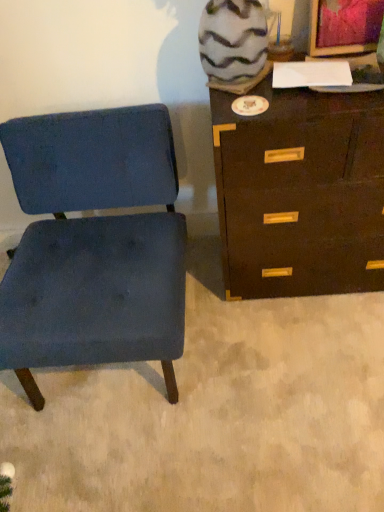
Find the location of a particular element. The width and height of the screenshot is (384, 512). blue fabric chair at left is located at coordinates (94, 244).

Describe the element at coordinates (94, 244) in the screenshot. I see `blue fabric chair at left` at that location.

The height and width of the screenshot is (512, 384). What do you see at coordinates (300, 193) in the screenshot? I see `dark brown wood chest of drawers at right` at bounding box center [300, 193].

Locate an element on the screen. This screenshot has height=512, width=384. dark brown wood chest of drawers at right is located at coordinates (300, 193).

At what (x,y) coordinates should I click in order to perform the action: click on blue fabric chair at left. Please return your answer as a coordinate pair (x, y). The width and height of the screenshot is (384, 512). Looking at the image, I should click on (94, 244).

Which is more to the right, dark brown wood chest of drawers at right or blue fabric chair at left?

Positioned to the right is dark brown wood chest of drawers at right.

Between dark brown wood chest of drawers at right and blue fabric chair at left, which one is positioned behind?

dark brown wood chest of drawers at right is further away from the camera.

Which is behind, point (373, 156) or point (55, 200)?

Positioned behind is point (55, 200).

From the image's perspective, which is above, dark brown wood chest of drawers at right or blue fabric chair at left?

dark brown wood chest of drawers at right is shown above in the image.

From a real-world perspective, is dark brown wood chest of drawers at right above or below blue fabric chair at left?

Clearly, from a real-world perspective, dark brown wood chest of drawers at right is above blue fabric chair at left.

Which object is wider, dark brown wood chest of drawers at right or blue fabric chair at left?

blue fabric chair at left.

Does dark brown wood chest of drawers at right have a lesser height compared to blue fabric chair at left?

No, dark brown wood chest of drawers at right is not shorter than blue fabric chair at left.

Does dark brown wood chest of drawers at right have a larger size compared to blue fabric chair at left?

No.

In the scene shown: Would you say blue fabric chair at left is part of dark brown wood chest of drawers at right's contents?

No, blue fabric chair at left is located outside of dark brown wood chest of drawers at right.

Is dark brown wood chest of drawers at right directly adjacent to blue fabric chair at left?

No, dark brown wood chest of drawers at right is not in contact with blue fabric chair at left.

Based on the photo, is dark brown wood chest of drawers at right facing towards blue fabric chair at left?

No, dark brown wood chest of drawers at right is not turned towards blue fabric chair at left.

Identify the location of chair that is under the dark brown wood chest of drawers at right (from a real-world perspective). Image resolution: width=384 pixels, height=512 pixels. (94, 244).

Does blue fabric chair at left appear on the right side of dark brown wood chest of drawers at right?

In fact, blue fabric chair at left is to the left of dark brown wood chest of drawers at right.

Is blue fabric chair at left in front of or behind dark brown wood chest of drawers at right in the image?

Clearly, blue fabric chair at left is in front of dark brown wood chest of drawers at right.

Which is less distant, (103, 133) or (324, 250)?

Point (103, 133) is positioned closer to the camera compared to point (324, 250).

From the image's perspective, is blue fabric chair at left above dark brown wood chest of drawers at right?

No.

From a real-world perspective, is blue fabric chair at left located beneath dark brown wood chest of drawers at right?

Yes.

Between blue fabric chair at left and dark brown wood chest of drawers at right, which one has larger width?

blue fabric chair at left.

Which of these two, blue fabric chair at left or dark brown wood chest of drawers at right, stands shorter?

blue fabric chair at left.

Which of these two, blue fabric chair at left or dark brown wood chest of drawers at right, is bigger?

Bigger between the two is blue fabric chair at left.

Is blue fabric chair at left surrounding dark brown wood chest of drawers at right?

That's incorrect, dark brown wood chest of drawers at right is not inside blue fabric chair at left.

Is blue fabric chair at left beside dark brown wood chest of drawers at right?

No, blue fabric chair at left is not making contact with dark brown wood chest of drawers at right.

Is blue fabric chair at left turned away from dark brown wood chest of drawers at right?

No, blue fabric chair at left is not facing the opposite direction of dark brown wood chest of drawers at right.

Image resolution: width=384 pixels, height=512 pixels. Identify the location of chest of drawers behind the blue fabric chair at left. (300, 193).

Locate an element on the screen. Image resolution: width=384 pixels, height=512 pixels. chair below the dark brown wood chest of drawers at right (from a real-world perspective) is located at coordinates (94, 244).

This screenshot has height=512, width=384. What are the coordinates of `chest of drawers on the right of blue fabric chair at left` in the screenshot? It's located at (300, 193).